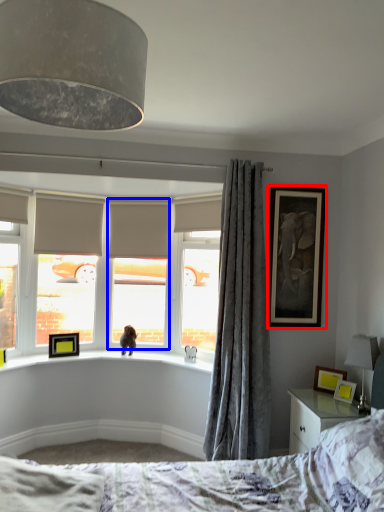
Question: Among these objects, which one is farthest to the camera, picture frame (highlighted by a red box) or window screen (highlighted by a blue box)?

Choices:
 (A) picture frame
 (B) window screen

Answer: (B)